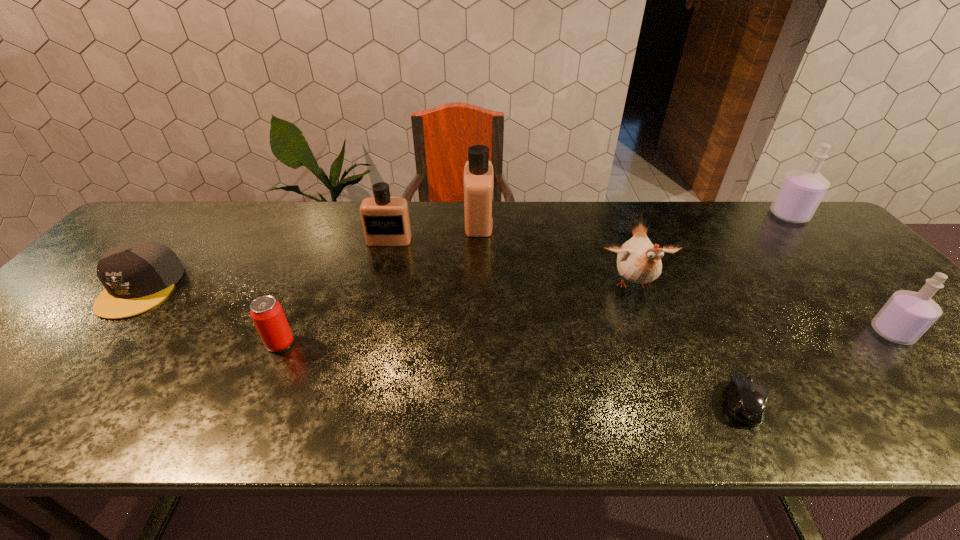
Identify the location of the leftmost object. The height and width of the screenshot is (540, 960). (137, 276).

The height and width of the screenshot is (540, 960). Find the location of `gray cap`. gray cap is located at coordinates (137, 276).

Where is `black mouse`? This screenshot has width=960, height=540. black mouse is located at coordinates (746, 399).

Locate an element on the screen. The image size is (960, 540). mouse is located at coordinates (746, 399).

Where is `free location located 0.290m on the front of the bigger purple perfume`? This screenshot has height=540, width=960. free location located 0.290m on the front of the bigger purple perfume is located at coordinates (859, 289).

The image size is (960, 540). What are the coordinates of `vacant space located on the front label of the third perfume from right to left` in the screenshot? It's located at (528, 221).

The image size is (960, 540). I want to click on vacant space positioned 0.230m at the beak of the bird, so click(672, 384).

The height and width of the screenshot is (540, 960). I want to click on vacant area situated on the front of the nearest perfume, so click(x=936, y=380).

I want to click on free space located on the front label of the smaller beige perfume, so click(383, 264).

The height and width of the screenshot is (540, 960). I want to click on blank area located 0.110m on the back of the sixth tallest object, so click(x=300, y=300).